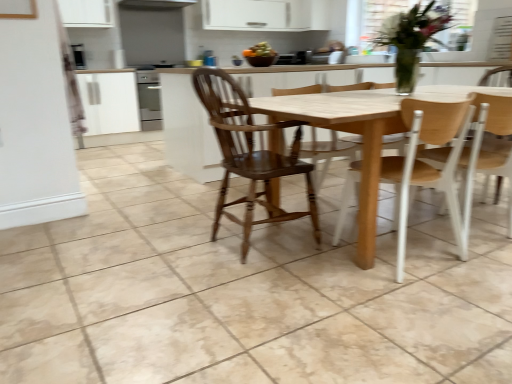
The image size is (512, 384). I want to click on light wood table at center, so click(x=349, y=132).

I want to click on wooden chair at center, which appears as the 3th chair when viewed from the right, so click(x=250, y=155).

Describe the element at coordinates (79, 56) in the screenshot. I see `black glossy microwave at upper left` at that location.

Where is `light wood table at center`? The image size is (512, 384). light wood table at center is located at coordinates (349, 132).

In the scene shown: Is wooden chair at center, marked as the second chair in a left-to-right arrangement, looking in the opposite direction of wooden chair at center, which appears as the 3th chair when viewed from the right?

That's not correct — wooden chair at center, marked as the second chair in a left-to-right arrangement, is not looking away from wooden chair at center, which appears as the 3th chair when viewed from the right.

Could wooden chair at center, which appears as the 3th chair when viewed from the right, be considered to be inside wooden chair at center, which is the 2th chair from right to left?

No, wooden chair at center, which appears as the 3th chair when viewed from the right, is not inside wooden chair at center, which is the 2th chair from right to left.

Is wooden chair at center, marked as the second chair in a left-to-right arrangement, in contact with wooden chair at center, which appears as the 3th chair when viewed from the right?

No, wooden chair at center, marked as the second chair in a left-to-right arrangement, is not next to wooden chair at center, which appears as the 3th chair when viewed from the right.

In terms of size, does wooden chair at center, marked as the second chair in a left-to-right arrangement, appear bigger or smaller than wooden chair at center, which appears as the 3th chair when viewed from the right?

Result: wooden chair at center, marked as the second chair in a left-to-right arrangement, is smaller than wooden chair at center, which appears as the 3th chair when viewed from the right.

Between light brown wood chair at right, which appears as the third chair when viewed from the left, and light wood table at center, which one is positioned in front?

light wood table at center is closer to the camera.

Measure the distance between light brown wood chair at right, which appears as the third chair when viewed from the left, and light wood table at center.

They are 16.77 inches apart.

Can you see light brown wood chair at right, which appears as the third chair when viewed from the left, touching light wood table at center?

light brown wood chair at right, which appears as the third chair when viewed from the left, and light wood table at center are not in contact.

At what (x,y) coordinates should I click in order to perform the action: click on kitchen & dining room table located on the left of light brown wood chair at right, which is counted as the first chair, starting from the right. Please return your answer as a coordinate pair (x, y). The width and height of the screenshot is (512, 384). Looking at the image, I should click on (349, 132).

Considering the sizes of objects light brown wood chair at right, which appears as the third chair when viewed from the left, and wooden chair at center, acting as the first chair starting from the left, in the image provided, who is smaller, light brown wood chair at right, which appears as the third chair when viewed from the left, or wooden chair at center, acting as the first chair starting from the left,?

With smaller size is light brown wood chair at right, which appears as the third chair when viewed from the left.

Looking at this image, which object is closer to the camera, light brown wood chair at right, which is counted as the first chair, starting from the right, or wooden chair at center, acting as the first chair starting from the left?

Positioned in front is wooden chair at center, acting as the first chair starting from the left.

Could you tell me if light brown wood chair at right, which appears as the third chair when viewed from the left, is facing wooden chair at center, which appears as the 3th chair when viewed from the right?

No, light brown wood chair at right, which appears as the third chair when viewed from the left, is not aimed at wooden chair at center, which appears as the 3th chair when viewed from the right.

Is wooden chair at center, which appears as the 3th chair when viewed from the right, inside light brown wood chair at right, which appears as the third chair when viewed from the left?

Definitely not — wooden chair at center, which appears as the 3th chair when viewed from the right, is not inside light brown wood chair at right, which appears as the third chair when viewed from the left.

Does wooden chair at center, acting as the first chair starting from the left, touch black glossy microwave at upper left?

There is a gap between wooden chair at center, acting as the first chair starting from the left, and black glossy microwave at upper left.

From the image's perspective, which object appears higher, wooden chair at center, which appears as the 3th chair when viewed from the right, or black glossy microwave at upper left?

black glossy microwave at upper left is shown above in the image.

Does wooden chair at center, which appears as the 3th chair when viewed from the right, lie in front of black glossy microwave at upper left?

Yes.

Which chair is the 2nd one when counting from the front of the black glossy microwave at upper left? Please provide its 2D coordinates.

[(250, 155)]

Does light wood table at center turn towards wooden chair at center, which appears as the 3th chair when viewed from the right?

No, light wood table at center is not oriented towards wooden chair at center, which appears as the 3th chair when viewed from the right.

From a real-world perspective, who is located higher, light wood table at center or wooden chair at center, which appears as the 3th chair when viewed from the right?

wooden chair at center, which appears as the 3th chair when viewed from the right, from a real-world perspective.

In terms of height, does light wood table at center look taller or shorter compared to wooden chair at center, acting as the first chair starting from the left?

Considering their sizes, light wood table at center has less height than wooden chair at center, acting as the first chair starting from the left.

Which is in front, light wood table at center or wooden chair at center, acting as the first chair starting from the left?

light wood table at center is closer to the camera.

Could you tell me if wooden chair at center, which appears as the 3th chair when viewed from the right, is facing light brown wood chair at right, which is counted as the first chair, starting from the right?

No, wooden chair at center, which appears as the 3th chair when viewed from the right, is not aimed at light brown wood chair at right, which is counted as the first chair, starting from the right.

From a real-world perspective, is wooden chair at center, acting as the first chair starting from the left, physically located above or below light brown wood chair at right, which appears as the third chair when viewed from the left?

wooden chair at center, acting as the first chair starting from the left, is above light brown wood chair at right, which appears as the third chair when viewed from the left.

Can you tell me how much wooden chair at center, acting as the first chair starting from the left, and light brown wood chair at right, which is counted as the first chair, starting from the right, differ in facing direction?

The facing directions of wooden chair at center, acting as the first chair starting from the left, and light brown wood chair at right, which is counted as the first chair, starting from the right, are 78.4 degrees apart.

Is wooden chair at center, which appears as the 3th chair when viewed from the right, not inside light brown wood chair at right, which appears as the third chair when viewed from the left?

Absolutely, wooden chair at center, which appears as the 3th chair when viewed from the right, is external to light brown wood chair at right, which appears as the third chair when viewed from the left.

Is smooth orange fruit bowl at upper center bigger than black glossy microwave at upper left?

Incorrect, smooth orange fruit bowl at upper center is not larger than black glossy microwave at upper left.

Looking at their sizes, would you say smooth orange fruit bowl at upper center is wider or thinner than black glossy microwave at upper left?

Considering their sizes, smooth orange fruit bowl at upper center looks broader than black glossy microwave at upper left.

Could you tell me if smooth orange fruit bowl at upper center is turned towards black glossy microwave at upper left?

No, smooth orange fruit bowl at upper center is not aimed at black glossy microwave at upper left.

Are smooth orange fruit bowl at upper center and black glossy microwave at upper left making contact?

No.

The width and height of the screenshot is (512, 384). I want to click on chair in front of the wooden chair at center, acting as the first chair starting from the left, so click(x=426, y=164).

From the image's perspective, starting from the light wood table at center, which chair is the 2nd one below? Please provide its 2D coordinates.

[(486, 151)]

Based on their spatial positions, is smooth orange fruit bowl at upper center or light wood table at center closer to wooden chair at center, which is the 2th chair from right to left?

Based on the image, light wood table at center appears to be nearer to wooden chair at center, which is the 2th chair from right to left.

When comparing their distances from wooden chair at center, marked as the second chair in a left-to-right arrangement, does light brown wood chair at right, which is counted as the first chair, starting from the right, or light wood table at center seem further?

light wood table at center is further to wooden chair at center, marked as the second chair in a left-to-right arrangement.

In the scene shown: When comparing their distances from smooth orange fruit bowl at upper center, does wooden chair at center, acting as the first chair starting from the left, or black glossy microwave at upper left seem further?

Among the two, black glossy microwave at upper left is located further to smooth orange fruit bowl at upper center.

Looking at the image, which one is located closer to wooden chair at center, acting as the first chair starting from the left, black glossy microwave at upper left or light wood table at center?

light wood table at center is positioned closer to the anchor wooden chair at center, acting as the first chair starting from the left.

Which object lies nearer to the anchor point wooden chair at center, marked as the second chair in a left-to-right arrangement, black glossy microwave at upper left or light wood table at center?

light wood table at center is closer to wooden chair at center, marked as the second chair in a left-to-right arrangement.

Estimate the real-world distances between objects in this image. Which object is closer to smooth orange fruit bowl at upper center, light brown wood chair at right, which appears as the third chair when viewed from the left, or wooden chair at center, which appears as the 3th chair when viewed from the right?

wooden chair at center, which appears as the 3th chair when viewed from the right, is positioned closer to the anchor smooth orange fruit bowl at upper center.

Which object lies further to the anchor point light wood table at center, smooth orange fruit bowl at upper center or black glossy microwave at upper left?

Based on the image, black glossy microwave at upper left appears to be further to light wood table at center.

From the picture: Looking at the image, which one is located further to wooden chair at center, marked as the second chair in a left-to-right arrangement, black glossy microwave at upper left or light brown wood chair at right, which is counted as the first chair, starting from the right?

Among the two, black glossy microwave at upper left is located further to wooden chair at center, marked as the second chair in a left-to-right arrangement.

I want to click on chair between wooden chair at center, acting as the first chair starting from the left, and light wood table at center from left to right, so click(426, 164).

Where is `food between wooden chair at center, acting as the first chair starting from the left, and black glossy microwave at upper left from front to back`? This screenshot has width=512, height=384. food between wooden chair at center, acting as the first chair starting from the left, and black glossy microwave at upper left from front to back is located at coordinates (259, 51).

Locate an element on the screen. kitchen & dining room table situated between wooden chair at center, acting as the first chair starting from the left, and light brown wood chair at right, which appears as the third chair when viewed from the left, from left to right is located at coordinates (349, 132).

You are a GUI agent. You are given a task and a screenshot of the screen. Output one action in this format:
    pyautogui.click(x=<x>, y=<y>)
    Task: Click on the food located between black glossy microwave at upper left and light brown wood chair at right, which is counted as the first chair, starting from the right, in the left-right direction
    This screenshot has height=384, width=512.
    Given the screenshot: What is the action you would take?
    pyautogui.click(x=259, y=51)